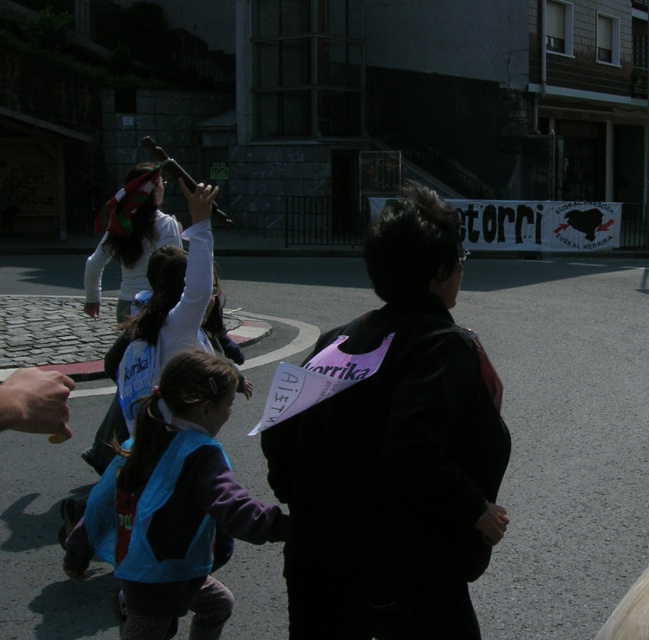
Can you confirm if blue fabric vest at lower left is smaller than white cotton shirt at upper left?

Yes, blue fabric vest at lower left is smaller than white cotton shirt at upper left.

The height and width of the screenshot is (640, 649). Describe the element at coordinates (175, 504) in the screenshot. I see `blue fabric vest at lower left` at that location.

The width and height of the screenshot is (649, 640). Describe the element at coordinates (175, 504) in the screenshot. I see `blue fabric vest at lower left` at that location.

You are a GUI agent. You are given a task and a screenshot of the screen. Output one action in this format:
    pyautogui.click(x=<x>, y=<y>)
    Task: Click on the blue fabric vest at lower left
    The height and width of the screenshot is (640, 649).
    Given the screenshot: What is the action you would take?
    pyautogui.click(x=175, y=504)

Between black fabric at center and blue fabric vest at lower left, which one has more height?

With more height is black fabric at center.

Identify the location of black fabric at center. This screenshot has width=649, height=640. (395, 451).

At what (x,y) coordinates should I click in order to perform the action: click on black fabric at center. Please return your answer as a coordinate pair (x, y). Looking at the image, I should click on (395, 451).

Is black fabric at center shorter than white cotton shirt at upper left?

Correct, black fabric at center is not as tall as white cotton shirt at upper left.

Who is shorter, black fabric at center or white cotton shirt at upper left?

With less height is black fabric at center.

Which is behind, point (304, 442) or point (101, 244)?

Point (101, 244)

Image resolution: width=649 pixels, height=640 pixels. In order to click on black fabric at center in this screenshot , I will do `click(395, 451)`.